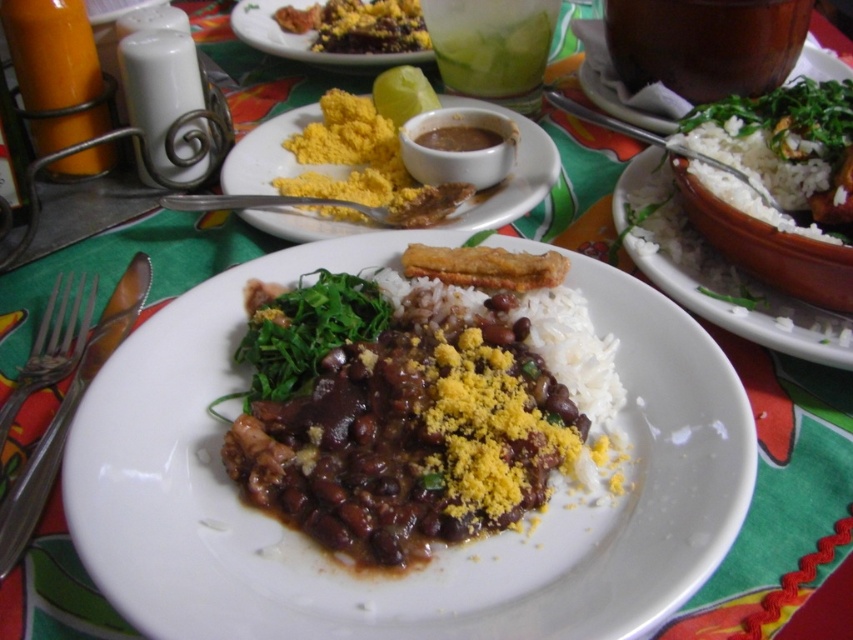
You are a food critic standing at the table. You need to describe the exact position of the white rice at right in terms of coordinates. What are its coordinates?

The white rice at right is located at the coordinates point (776, 150).